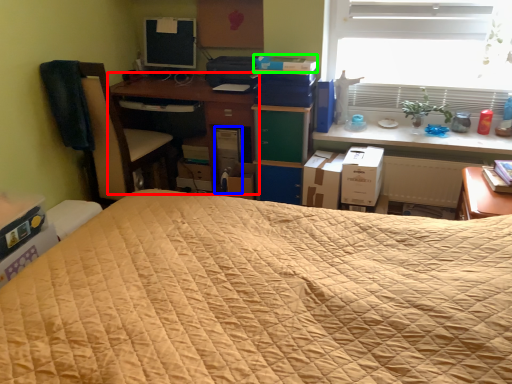
Question: Which is nearer to the desk (highlighted by a red box)? computer tower (highlighted by a blue box) or paperback book (highlighted by a green box).

Choices:
 (A) computer tower
 (B) paperback book

Answer: (A)